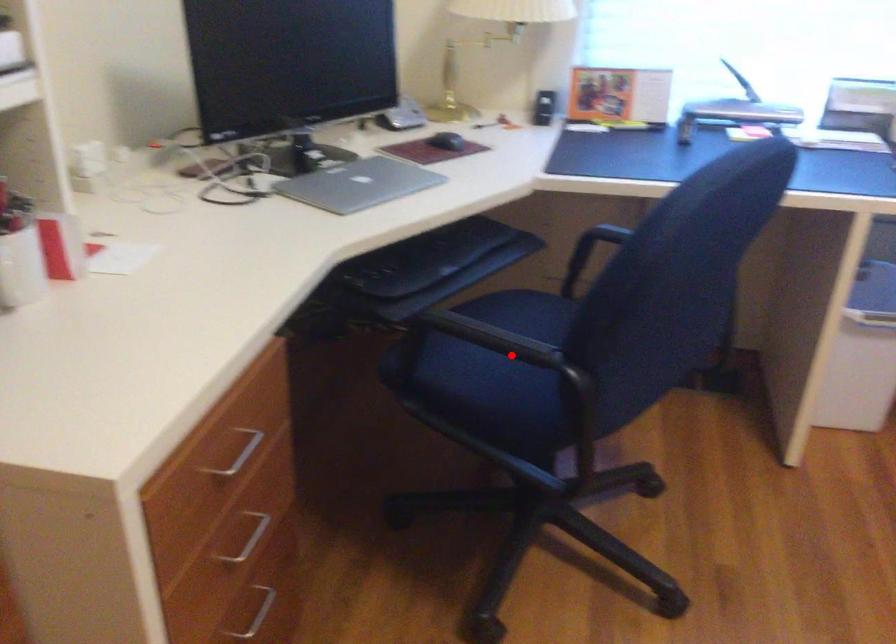
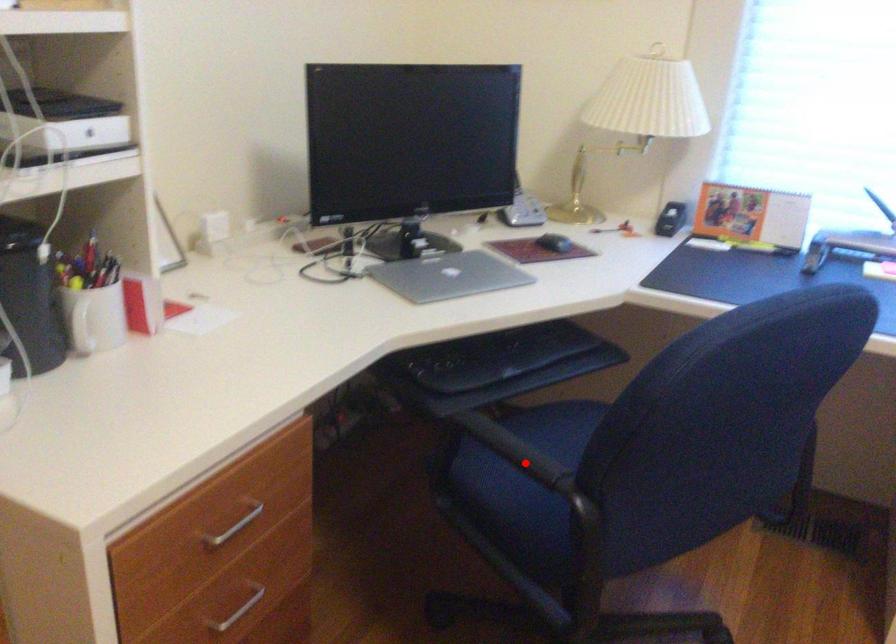
I am providing you with two images of the same scene from different viewpoints. A red point is marked on the first image and another point is marked on the second image. Do the highlighted points in image1 and image2 indicate the same real-world spot?

Yes